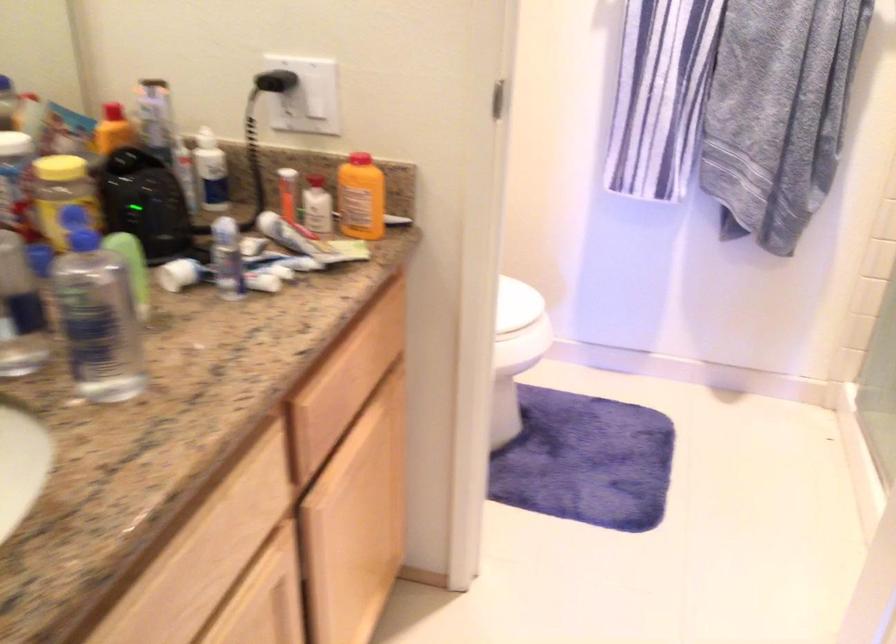
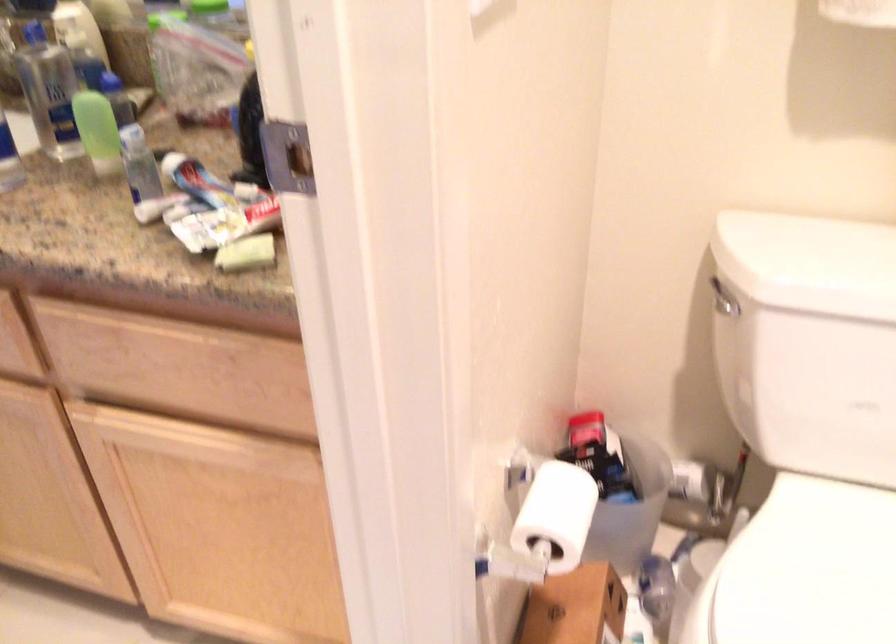
Where in the second image is the point corresponding to point 209,275 from the first image?

(197, 182)